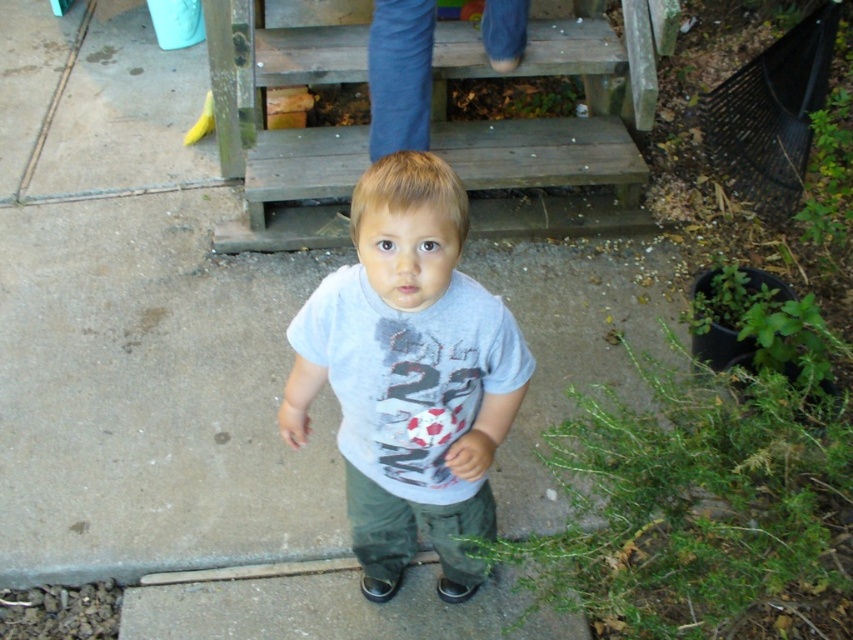
Question: Which point is farther from the camera taking this photo?

Choices:
 (A) (262, 237)
 (B) (374, 480)

Answer: (A)

Question: Considering the relative positions of gray cotton shirt at center and wooden stairs at upper center in the image provided, where is gray cotton shirt at center located with respect to wooden stairs at upper center?

Choices:
 (A) left
 (B) right

Answer: (A)

Question: Among these points, which one is farthest from the camera?

Choices:
 (A) (398, 168)
 (B) (612, 163)

Answer: (B)

Question: Which point appears closest to the camera in this image?

Choices:
 (A) (534, 45)
 (B) (305, 420)

Answer: (B)

Question: Is gray cotton shirt at center above wooden stairs at upper center?

Choices:
 (A) yes
 (B) no

Answer: (B)

Question: Does gray cotton shirt at center appear over wooden stairs at upper center?

Choices:
 (A) no
 (B) yes

Answer: (A)